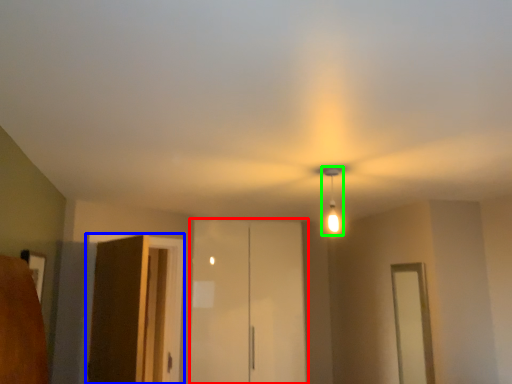
Question: Which object is the closest to the elevator (highlighted by a red box)? Choose among these: elevator (highlighted by a blue box) or light fixture (highlighted by a green box).

Choices:
 (A) elevator
 (B) light fixture

Answer: (A)